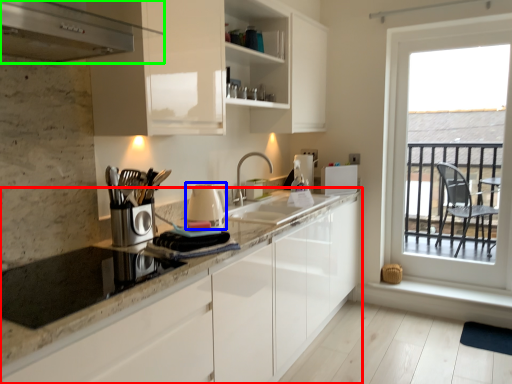
Question: Which is nearer to the countertop (highlighted by a red box)? appliance (highlighted by a blue box) or kitchen appliance (highlighted by a green box).

Choices:
 (A) appliance
 (B) kitchen appliance

Answer: (A)